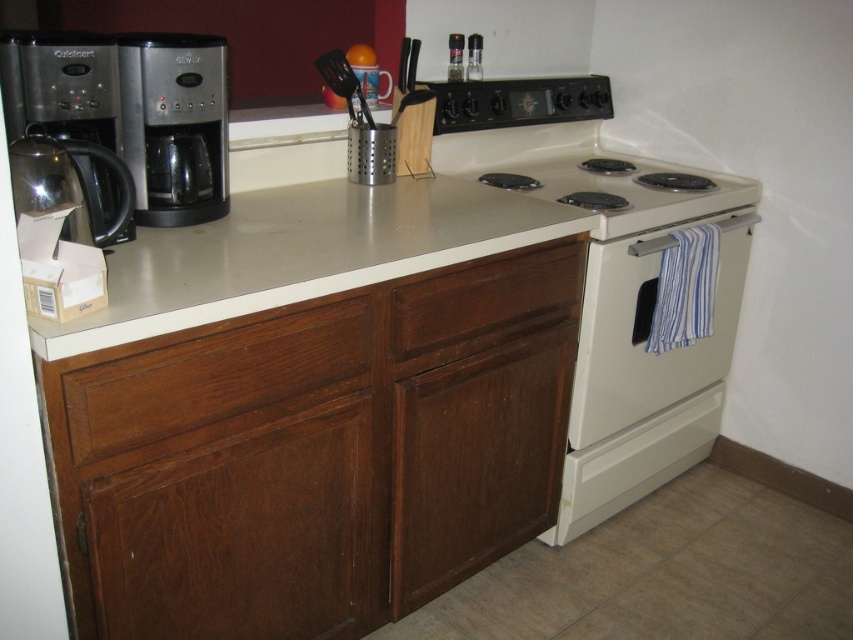
At what (x,y) coordinates should I click in order to perform the action: click on white glossy oven at center. Please return your answer as a coordinate pair (x, y). This screenshot has width=853, height=640. Looking at the image, I should click on (643, 376).

At what (x,y) coordinates should I click in order to perform the action: click on white glossy oven at center. Please return your answer as a coordinate pair (x, y). This screenshot has height=640, width=853. Looking at the image, I should click on (643, 376).

Can you confirm if stainless steel coffee maker at left is wider than wooden drawer at center?

No.

Looking at this image, between stainless steel coffee maker at left and wooden drawer at center, which one is positioned lower?

wooden drawer at center

Is point (96, 116) closer to viewer compared to point (508, 320)?

Yes.

In order to click on stainless steel coffee maker at left in this screenshot , I will do [x=73, y=115].

Is white glossy oven at center positioned at the back of sleek metallic coffee maker at left?

Yes, it is behind sleek metallic coffee maker at left.

Does point (663, 436) come farther from viewer compared to point (186, 189)?

That is True.

The image size is (853, 640). I want to click on white glossy oven at center, so click(643, 376).